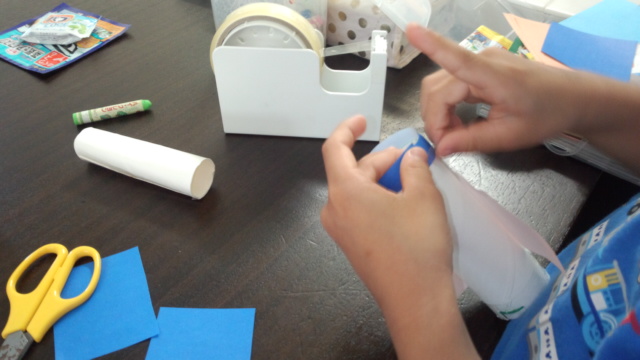
Please find where i'd pickup scissors in the image and show me where they are. Your answer should be formatted as a list of tuples, i.e. [(x1, y1), (x2, y2), ...], where each tuple contains the x and y coordinates of a point satisfying the conditions above.

[(35, 252)]